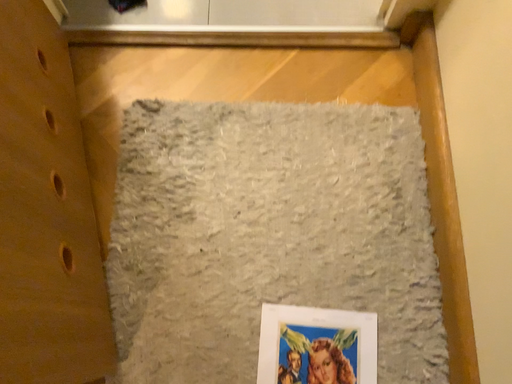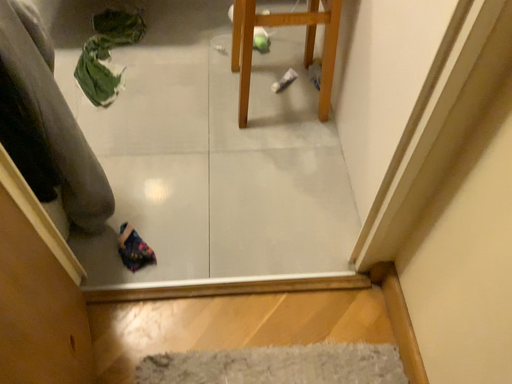
Question: How did the camera likely rotate when shooting the video?

Choices:
 (A) rotated downward
 (B) rotated upward

Answer: (B)